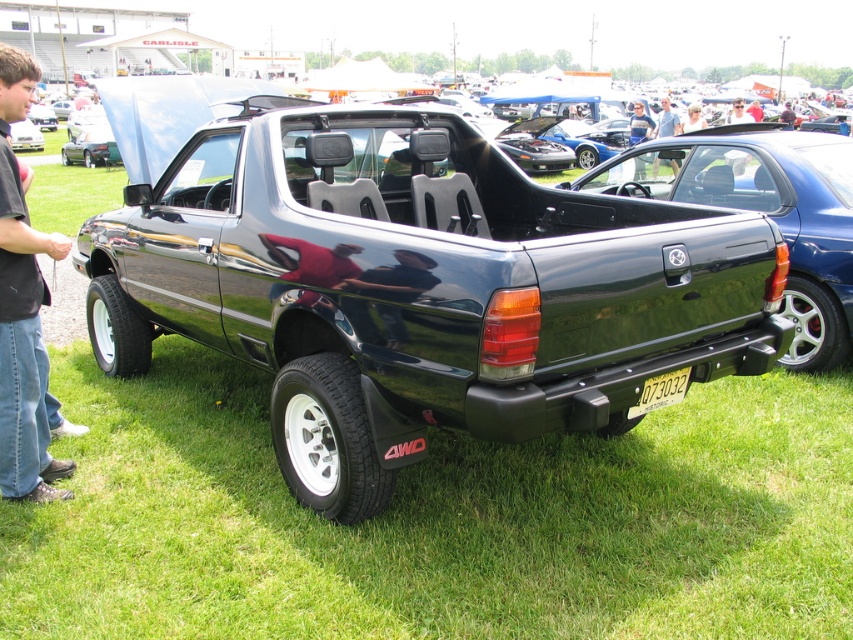
You are a photographer at the car show and want to take a photo of the blue jeans at center and the gray fabric shirt at upper center. Which object should you focus on first if you want to capture both in one frame without moving the camera?

The blue jeans at center is to the left of gray fabric shirt at upper center, so you should focus on the gray fabric shirt at upper center first as it is closer to the camera, allowing both objects to be in the frame without moving the camera.

You are standing at the front of the black pickup truck parked on the grassy field. You see a point marked at coordinates (x=639, y=124). What object is located at this point?

The point at coordinates (x=639, y=124) marks blue jeans at center.

You are a photographer at the car show and want to capture both the blue jeans at center and the light brown leather jacket at center in a single frame. Which item should you focus on first to ensure both are in the frame?

The blue jeans at center has a lesser height compared to the light brown leather jacket at center, so you should focus on the blue jeans at center first to ensure both are in the frame.